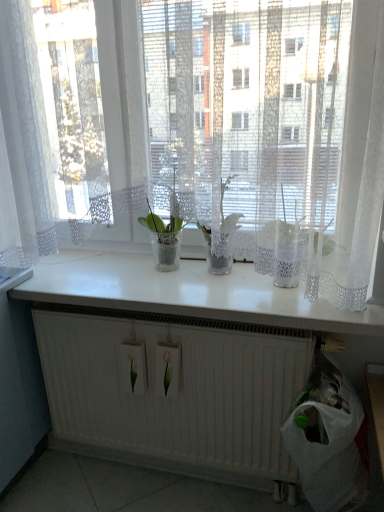
Question: Does point (109, 303) appear closer or farther from the camera than point (77, 329)?

Choices:
 (A) farther
 (B) closer

Answer: (B)

Question: From a real-world perspective, is white glossy counter top at center positioned above or below white matte radiator at lower center?

Choices:
 (A) below
 (B) above

Answer: (B)

Question: Which object is positioned closest to the white lace curtain at upper center?

Choices:
 (A) translucent glass vase at center
 (B) white plastic bag at lower right
 (C) white matte radiator at lower center
 (D) white glossy counter top at center
 (E) translucent glass vase at center

Answer: (E)

Question: Estimate the real-world distances between objects in this image. Which object is closer to the translucent glass vase at center?

Choices:
 (A) white plastic bag at lower right
 (B) white matte radiator at lower center
 (C) white glossy counter top at center
 (D) white lace curtain at upper center
 (E) translucent glass vase at center

Answer: (E)